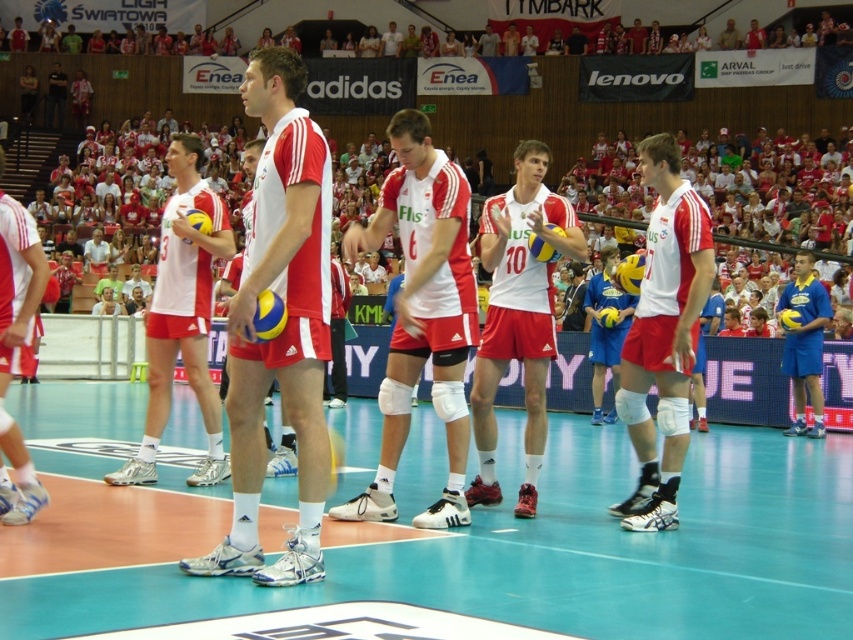
You are a photographer standing at the edge of the volleyball court. You want to take a photo of the white matte shorts at center and the white matte volleyball at center. Which object should you zoom in on to capture more detail, considering their sizes?

The white matte volleyball at center is larger than the white matte shorts at center, so you should zoom in on the white matte volleyball at center to capture more detail.

You are a photographer standing at the edge of the volleyball court. You want to take a photo of the white matte shorts at center. Where should you aim your camera?

You should aim your camera at point (663, 333) to capture the white matte shorts at center.